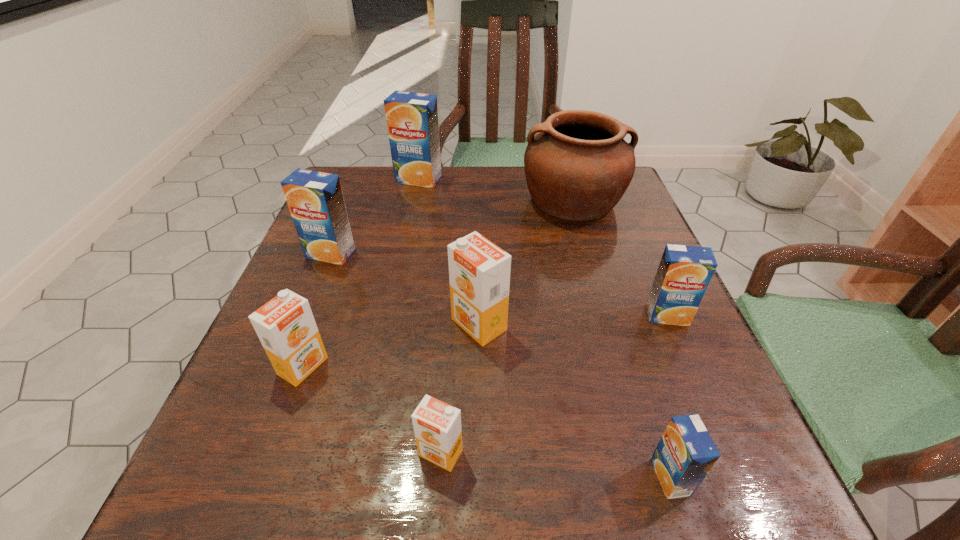
You are a GUI agent. You are given a task and a screenshot of the screen. Output one action in this format:
    pyautogui.click(x=<x>, y=<y>)
    Task: Click on the third blue orange_juice from left to right
    This screenshot has width=960, height=540.
    Given the screenshot: What is the action you would take?
    pyautogui.click(x=685, y=454)

Locate an element on the screen. This screenshot has width=960, height=540. the nearest orange orange juice is located at coordinates (437, 425).

This screenshot has width=960, height=540. Find the location of `vacant space situated on the left of the farthest blue orange_juice`. vacant space situated on the left of the farthest blue orange_juice is located at coordinates (354, 179).

At what (x,y) coordinates should I click in order to perform the action: click on vacant space positioned 0.250m on the left of the reddish pottery. Please return your answer as a coordinate pair (x, y). Looking at the image, I should click on (420, 200).

Locate an element on the screen. Image resolution: width=960 pixels, height=540 pixels. vacant region located on the front of the leftmost blue orange_juice is located at coordinates (252, 451).

At what (x,y) coordinates should I click in order to perform the action: click on free location located 0.130m on the back of the biggest orange orange juice. Please return your answer as a coordinate pair (x, y). Image resolution: width=960 pixels, height=540 pixels. Looking at the image, I should click on (479, 260).

The image size is (960, 540). In order to click on vacant position located 0.070m on the back of the rightmost blue orange_juice in this screenshot , I will do (652, 280).

Locate an element on the screen. This screenshot has height=540, width=960. vacant area situated 0.250m on the back of the leftmost orange orange juice is located at coordinates (344, 254).

In order to click on vacant space located 0.060m on the back of the second orange juice from right to left in this screenshot , I will do `click(651, 417)`.

Where is `free space located on the right of the nearest orange orange juice`? The image size is (960, 540). free space located on the right of the nearest orange orange juice is located at coordinates (736, 453).